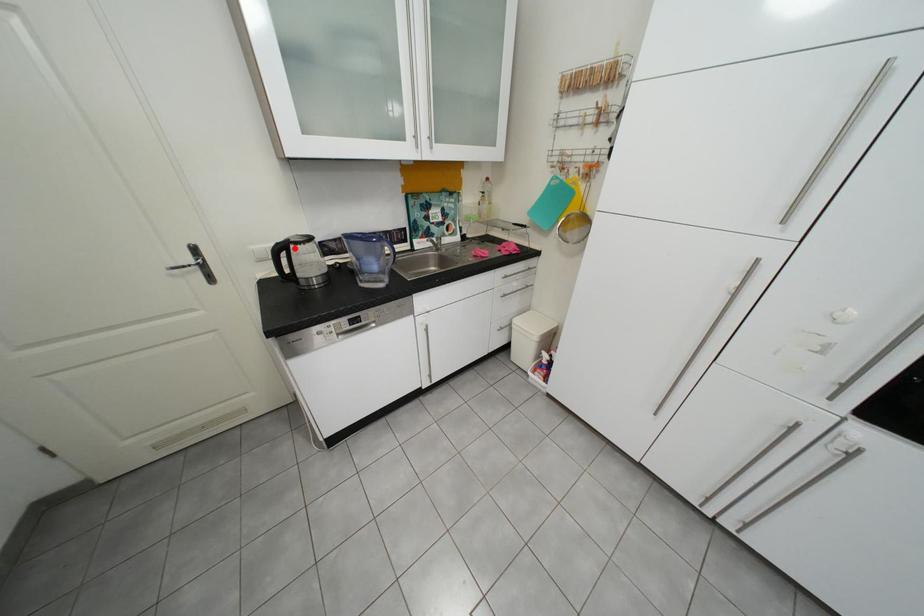
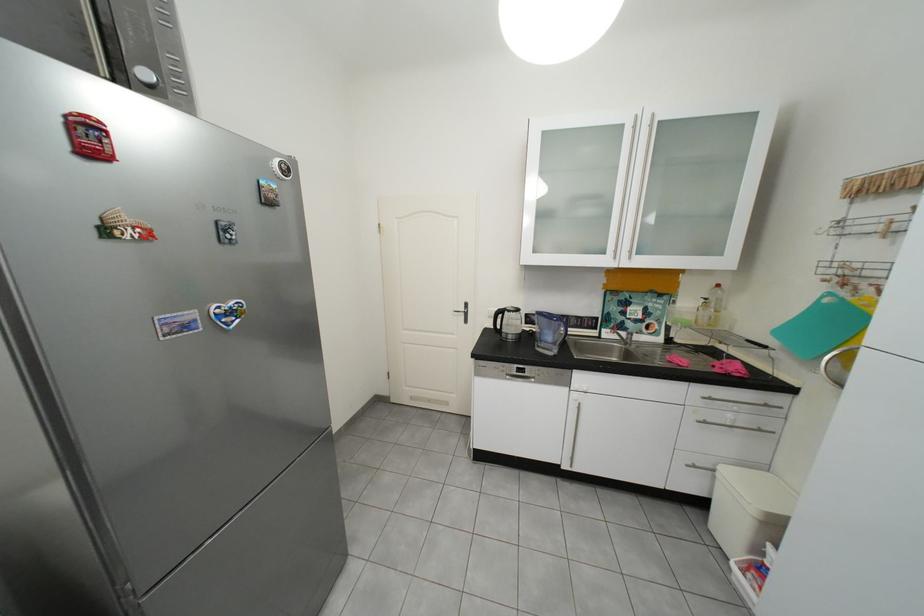
Find the pixel in the second image that matches the highlighted location in the first image.

(513, 313)